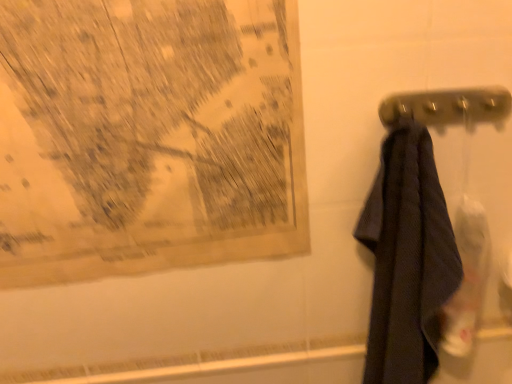
Question: Is yellowed paper map at upper left outside black textured towel at right?

Choices:
 (A) yes
 (B) no

Answer: (A)

Question: Considering the relative sizes of yellowed paper map at upper left and black textured towel at right in the image provided, is yellowed paper map at upper left wider than black textured towel at right?

Choices:
 (A) yes
 (B) no

Answer: (B)

Question: Does yellowed paper map at upper left lie in front of black textured towel at right?

Choices:
 (A) no
 (B) yes

Answer: (A)

Question: From the image's perspective, does yellowed paper map at upper left appear lower than black textured towel at right?

Choices:
 (A) no
 (B) yes

Answer: (A)

Question: Is yellowed paper map at upper left to the right of black textured towel at right from the viewer's perspective?

Choices:
 (A) no
 (B) yes

Answer: (A)

Question: Is metallic gray towel bar at right taller or shorter than black textured towel at right?

Choices:
 (A) short
 (B) tall

Answer: (A)

Question: Is point (492, 100) positioned closer to the camera than point (420, 294)?

Choices:
 (A) closer
 (B) farther

Answer: (A)

Question: Is metallic gray towel bar at right wider or thinner than black textured towel at right?

Choices:
 (A) wide
 (B) thin

Answer: (B)

Question: Considering the relative positions of metallic gray towel bar at right and black textured towel at right in the image provided, is metallic gray towel bar at right to the left or to the right of black textured towel at right?

Choices:
 (A) left
 (B) right

Answer: (B)

Question: Is yellowed paper map at upper left inside or outside of black textured towel at right?

Choices:
 (A) outside
 (B) inside

Answer: (A)

Question: Does point (203, 89) appear closer or farther from the camera than point (389, 349)?

Choices:
 (A) farther
 (B) closer

Answer: (B)

Question: Considering the positions of yellowed paper map at upper left and black textured towel at right in the image, is yellowed paper map at upper left wider or thinner than black textured towel at right?

Choices:
 (A) thin
 (B) wide

Answer: (A)

Question: Considering the positions of yellowed paper map at upper left and black textured towel at right in the image, is yellowed paper map at upper left taller or shorter than black textured towel at right?

Choices:
 (A) tall
 (B) short

Answer: (B)

Question: From the image's perspective, is black textured towel at right above or below yellowed paper map at upper left?

Choices:
 (A) above
 (B) below

Answer: (B)

Question: Considering the positions of point (419, 185) and point (121, 148), is point (419, 185) closer or farther from the camera than point (121, 148)?

Choices:
 (A) closer
 (B) farther

Answer: (B)